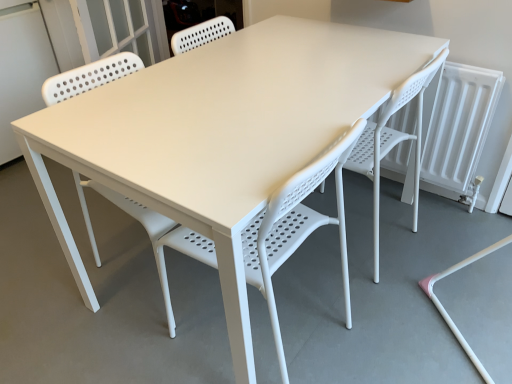
Identify the location of unoccupied region to the right of white plastic chair at center, which is counted as the 1th chair, starting from the right. Image resolution: width=512 pixels, height=384 pixels. (438, 233).